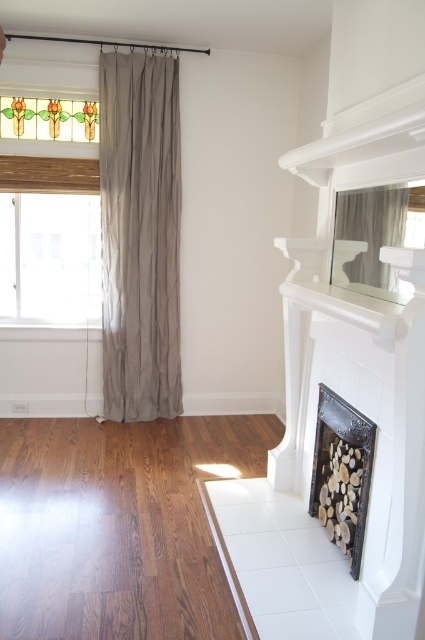
Based on the scene description, where is the clear glass window at left located in terms of its 2D coordinates?

The clear glass window at left is located at the 2D coordinates point (x=50, y=257).